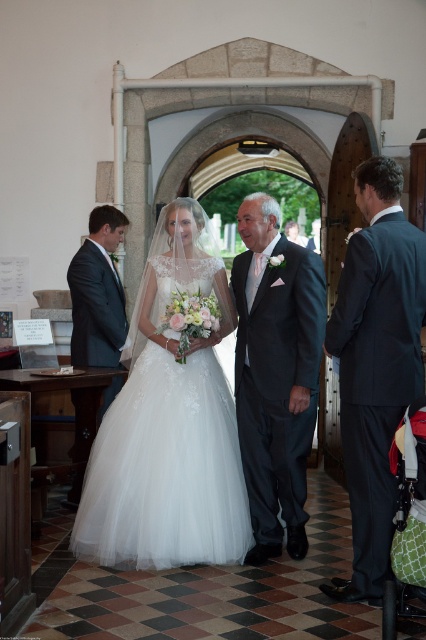
Question: Does white satin dress at center have a lesser width compared to matte black suit at left?

Choices:
 (A) no
 (B) yes

Answer: (A)

Question: Which point is farther to the camera?

Choices:
 (A) (353, 516)
 (B) (264, 384)

Answer: (B)

Question: Does white satin dress at center have a smaller size compared to matte black suit at left?

Choices:
 (A) yes
 (B) no

Answer: (B)

Question: Which point appears farthest from the camera in this image?

Choices:
 (A) (94, 310)
 (B) (388, 320)

Answer: (A)

Question: Which object is the closest to the white satin dress at center?

Choices:
 (A) dark gray suit at center
 (B) white tulle dress at center
 (C) dark grey suit at right

Answer: (A)

Question: Does white satin dress at center have a smaller size compared to dark grey suit at right?

Choices:
 (A) yes
 (B) no

Answer: (B)